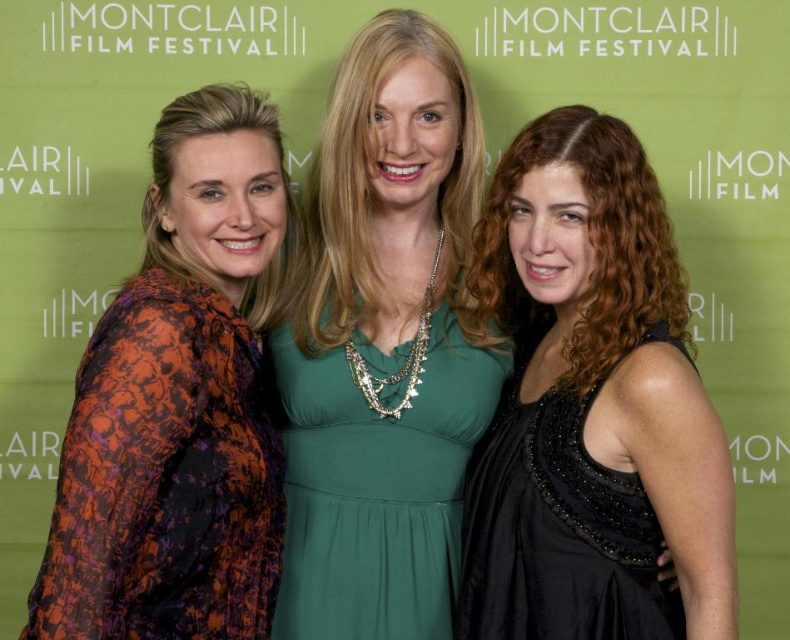
Which is in front, point (271, 211) or point (412, 572)?

Point (271, 211)

Between point (155, 205) and point (454, 404), which one is positioned in front?

Point (155, 205) is more forward.

Locate an element on the screen. orange floral dress at left is located at coordinates (179, 403).

Which is more to the right, orange floral dress at left or black satin dress at right?

Positioned to the right is black satin dress at right.

Is orange floral dress at left thinner than black satin dress at right?

Yes, orange floral dress at left is thinner than black satin dress at right.

Which is behind, point (277, 220) or point (499, 634)?

Positioned behind is point (277, 220).

You are a GUI agent. You are given a task and a screenshot of the screen. Output one action in this format:
    pyautogui.click(x=<x>, y=<y>)
    Task: Click on the orange floral dress at left
    The image size is (790, 640).
    Given the screenshot: What is the action you would take?
    pyautogui.click(x=179, y=403)

Does point (408, 579) lie in front of point (659, 337)?

No, (408, 579) is behind (659, 337).

Is point (395, 637) positioned after point (578, 634)?

Yes, it is.

What are the coordinates of `emerald green jersey dress at center` in the screenshot? It's located at pos(377,488).